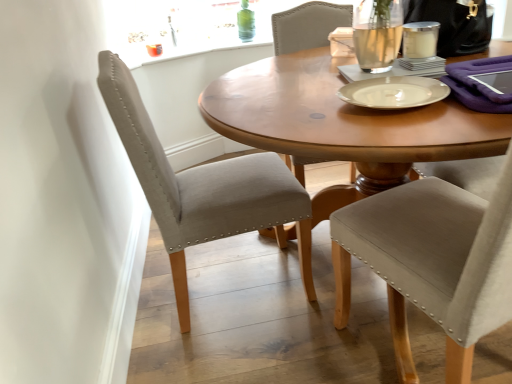
Where is `free point to the left of satin beige chair at upper right, the second chair from the left`? This screenshot has height=384, width=512. free point to the left of satin beige chair at upper right, the second chair from the left is located at coordinates (288, 347).